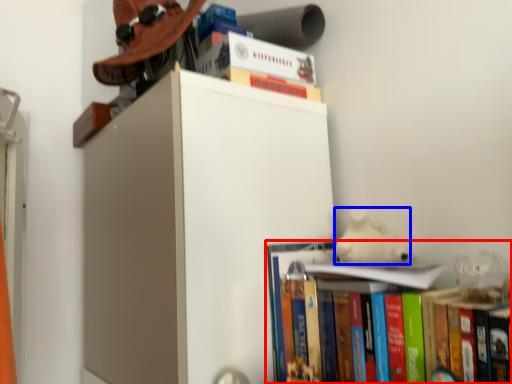
Question: Which object is further to the camera taking this photo, book (highlighted by a red box) or animal (highlighted by a blue box)?

Choices:
 (A) book
 (B) animal

Answer: (B)